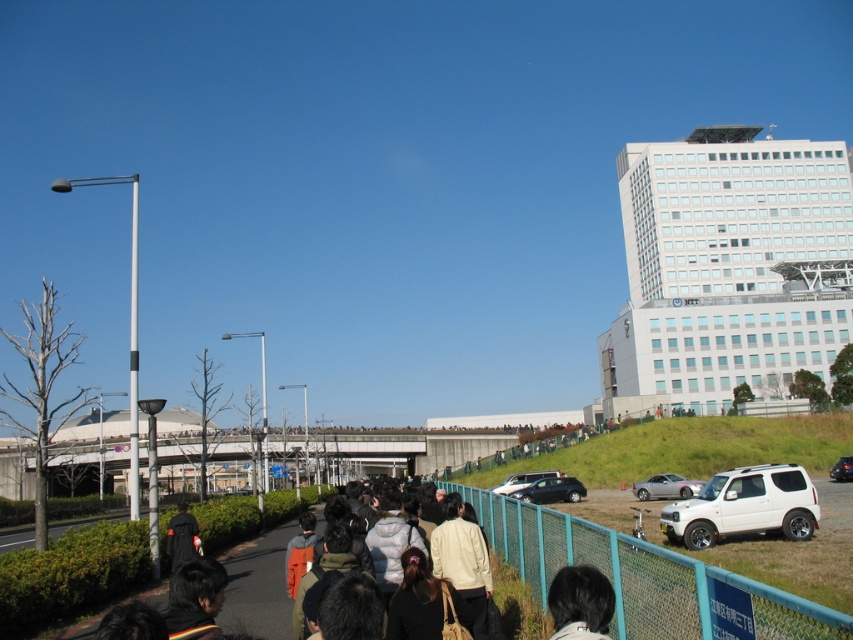
Between white matte suv at lower right and black matte suv at center, which one has more height?

white matte suv at lower right is taller.

Which is in front, point (723, 531) or point (843, 476)?

Point (723, 531)

The width and height of the screenshot is (853, 640). I want to click on white matte suv at lower right, so click(744, 506).

Consider the image. Does white matte suv at lower right have a greater width compared to black matte jacket at lower left?

Yes, white matte suv at lower right is wider than black matte jacket at lower left.

Which is behind, point (788, 522) or point (193, 545)?

The point (788, 522) is behind.

This screenshot has height=640, width=853. I want to click on white matte suv at lower right, so click(x=744, y=506).

Does black hair at lower center appear over black matte jacket at lower left?

Indeed, black hair at lower center is positioned over black matte jacket at lower left.

Which is below, black hair at lower center or black matte jacket at lower left?

black matte jacket at lower left is lower down.

What do you see at coordinates (579, 598) in the screenshot? Image resolution: width=853 pixels, height=640 pixels. I see `black hair at lower center` at bounding box center [579, 598].

Image resolution: width=853 pixels, height=640 pixels. In order to click on black hair at lower center in this screenshot , I will do `click(579, 598)`.